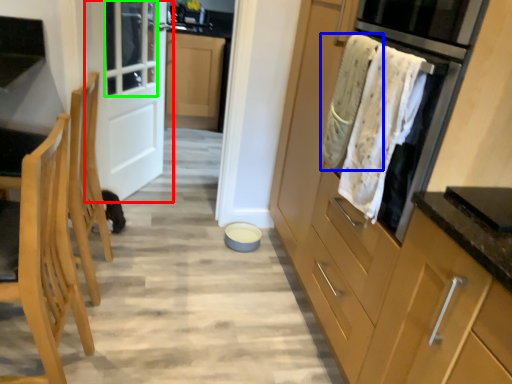
Question: Which object is positioned farthest from door (highlighted by a red box)? Select from laundry (highlighted by a blue box) and window (highlighted by a green box).

Choices:
 (A) laundry
 (B) window

Answer: (A)